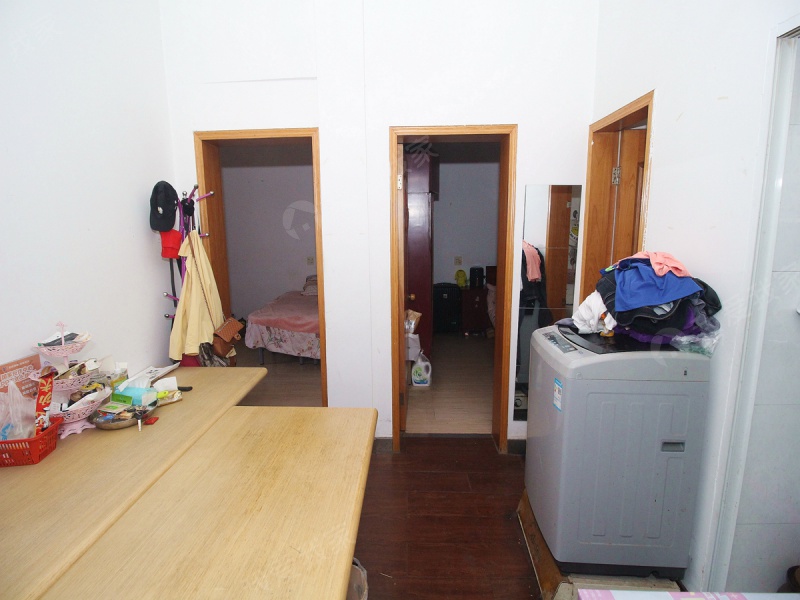
This screenshot has height=600, width=800. I want to click on pink bed, so click(x=296, y=316).